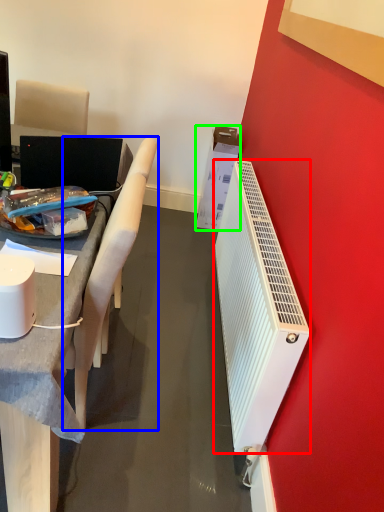
Question: Which is farther away from radiator (highlighted by a red box)? chair (highlighted by a blue box) or box (highlighted by a green box)?

Choices:
 (A) chair
 (B) box

Answer: (B)